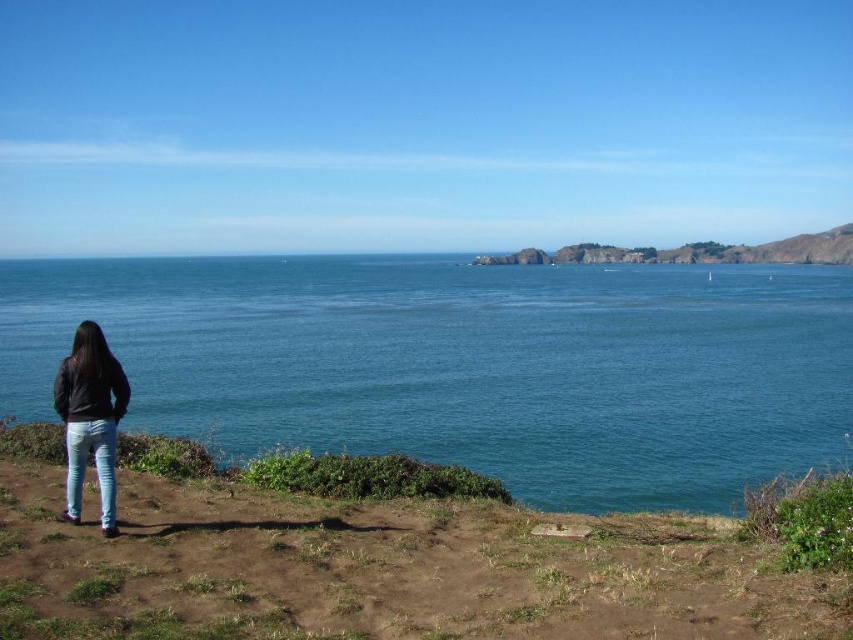
Question: Based on their relative distances, which object is nearer to the blue denim jeans at lower left?

Choices:
 (A) blue water at center
 (B) rugged rock formation at center

Answer: (A)

Question: Does blue water at center have a larger size compared to rugged rock formation at center?

Choices:
 (A) no
 (B) yes

Answer: (B)

Question: Which object appears closest to the camera in this image?

Choices:
 (A) brown dirt at lower left
 (B) blue denim jeans at lower left
 (C) jeans at left

Answer: (A)

Question: Considering the relative positions of rugged rock formation at center and blue denim jeans at lower left in the image provided, where is rugged rock formation at center located with respect to blue denim jeans at lower left?

Choices:
 (A) left
 (B) right

Answer: (B)

Question: Considering the real-world distances, which object is farthest from the jeans at left?

Choices:
 (A) brown dirt at lower left
 (B) blue water at center

Answer: (B)

Question: Is jeans at left smaller than rugged rock formation at center?

Choices:
 (A) yes
 (B) no

Answer: (A)